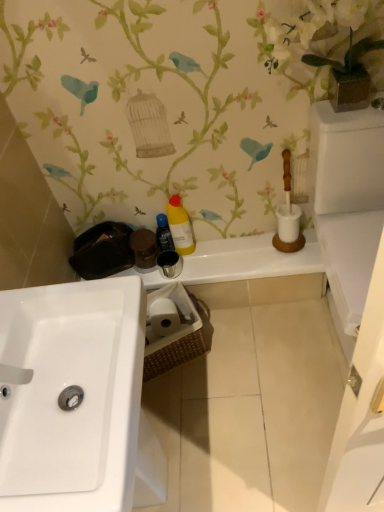
You are a GUI agent. You are given a task and a screenshot of the screen. Output one action in this format:
    pyautogui.click(x=<x>, y=<y>)
    Task: Click on the vacant point above matte black toiletries at center (from a real-world perspective)
    The height and width of the screenshot is (512, 384).
    Given the screenshot: What is the action you would take?
    pyautogui.click(x=224, y=254)